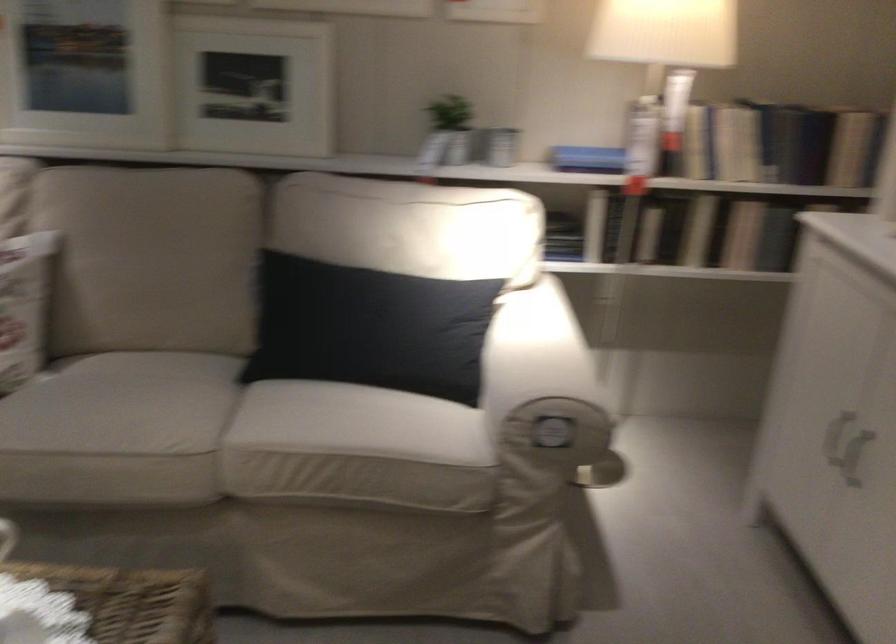
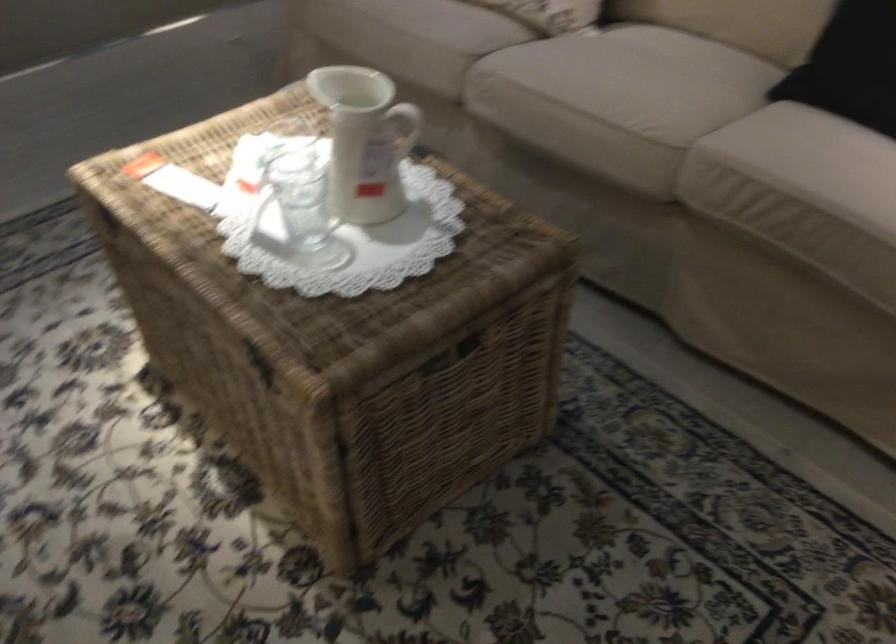
Find the pixel in the second image that matches point (122, 429) in the first image.

(617, 93)